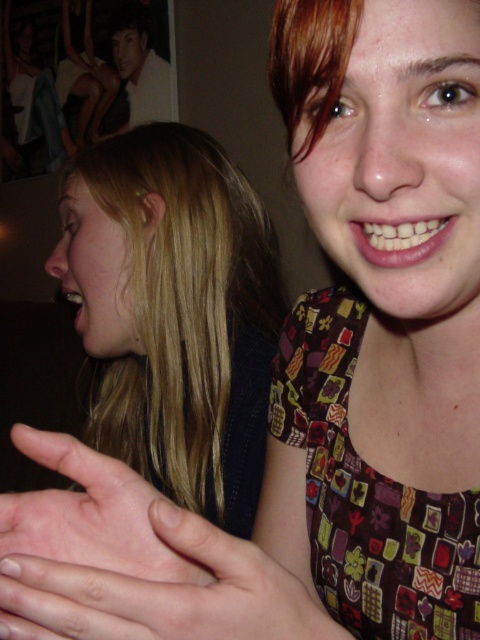
You are a photographer trying to capture a closeup shot of both pink matte skin at center and pink flesh at center. Since you can only focus on one subject at a time, which one should you choose to ensure the other is still somewhat in focus?

Since the pink matte skin at center is taller than the pink flesh at center, focusing on the pink matte skin at center would place the pink flesh at center closer to the focal plane, resulting in better secondary focus.

You are an artist trying to sketch this scene. You notice the pink flesh at center and the smooth white shirt at upper left. Which object should you focus on drawing first if you want to capture the most prominent elements first?

The smooth white shirt at upper left should be focused on first because it occupies more space than the pink flesh at center, making it a more prominent element in the scene.